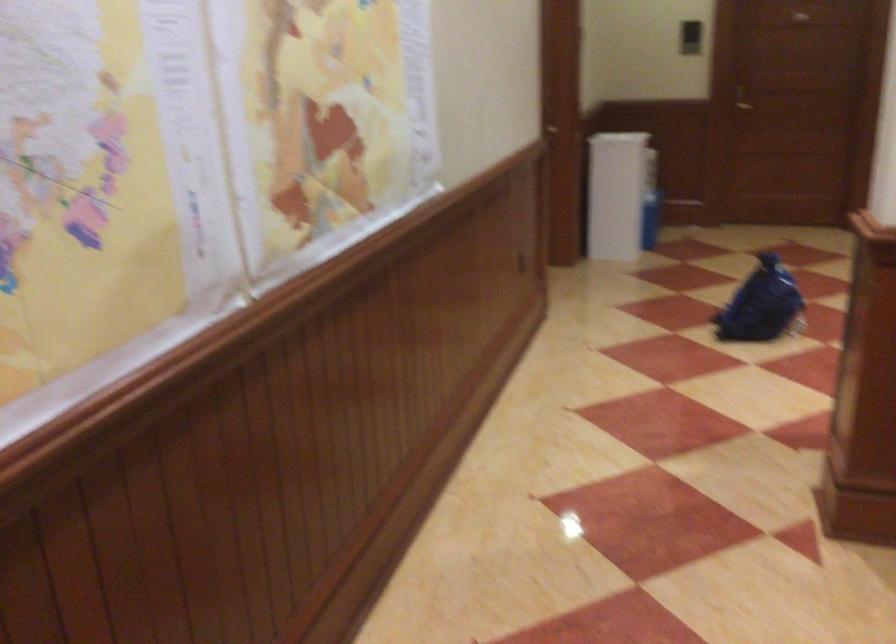
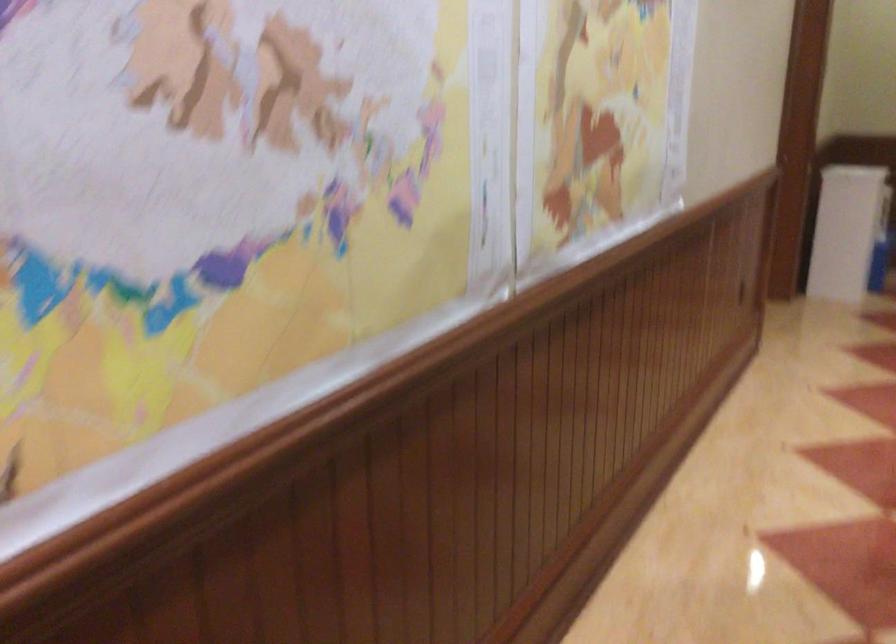
Question: What movement of the cameraman would produce the second image?

Choices:
 (A) Left
 (B) Right
 (C) Forward
 (D) Backward

Answer: (A)